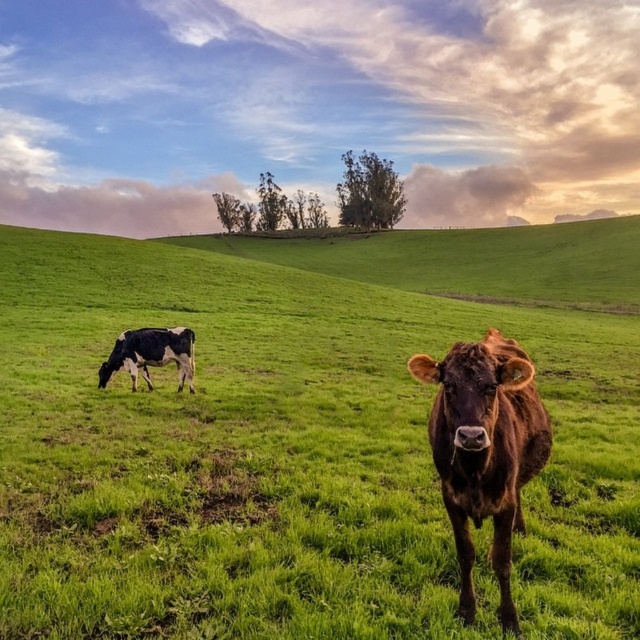
Is green grass pasture at center further to camera compared to black and white spotted cow at left?

No, green grass pasture at center is closer to the viewer.

Consider the image. Does green grass pasture at center appear on the left side of black and white spotted cow at left?

No, green grass pasture at center is not to the left of black and white spotted cow at left.

Does point (224, 552) come closer to viewer compared to point (173, 355)?

Yes.

Image resolution: width=640 pixels, height=640 pixels. Find the location of `green grass pasture at center`. green grass pasture at center is located at coordinates (305, 435).

Between point (452, 401) and point (132, 374), which one is positioned in front?

Point (452, 401)

Who is positioned more to the right, brown glossy bull at center or black and white spotted cow at left?

From the viewer's perspective, brown glossy bull at center appears more on the right side.

Locate an element on the screen. brown glossy bull at center is located at coordinates (484, 449).

Identify the location of brown glossy bull at center. (484, 449).

Describe the element at coordinates (305, 435) in the screenshot. I see `green grass pasture at center` at that location.

Between green grass pasture at center and brown glossy bull at center, which one appears on the right side from the viewer's perspective?

From the viewer's perspective, green grass pasture at center appears more on the right side.

Is point (321, 410) positioned in front of point (538, 444)?

That is False.

You are a GUI agent. You are given a task and a screenshot of the screen. Output one action in this format:
    pyautogui.click(x=<x>, y=<y>)
    Task: Click on the green grass pasture at center
    The image size is (640, 640).
    Given the screenshot: What is the action you would take?
    pyautogui.click(x=305, y=435)